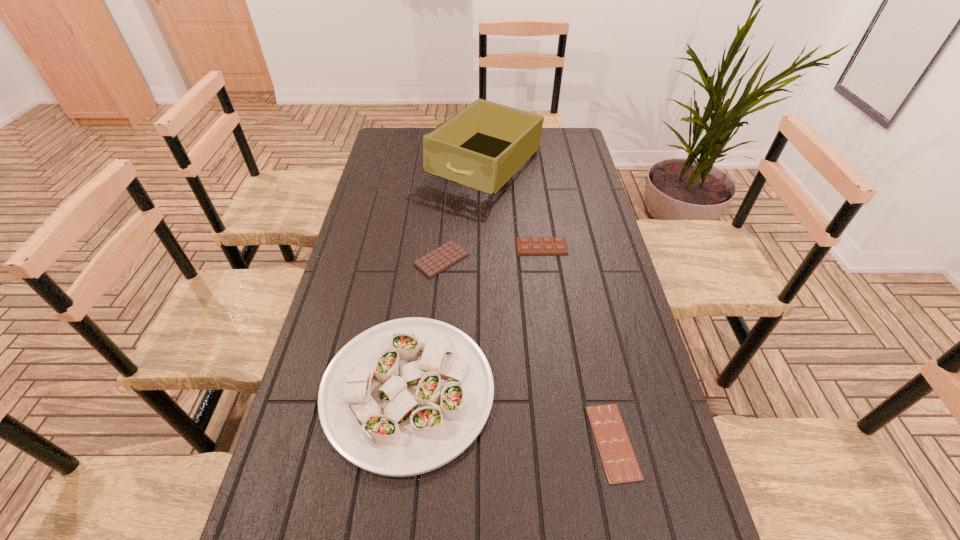
At what (x,y) coordinates should I click in order to perform the action: click on vacant space that satisfies the following two spatial constraints: 1. on the front side of the third tallest object; 2. on the right side of the shortest chocolate bar. Please return your answer as a coordinate pair (x, y). Looking at the image, I should click on (569, 442).

This screenshot has width=960, height=540. In order to click on free space that satisfies the following two spatial constraints: 1. on the front side of the tallest chocolate bar; 2. on the right side of the shortest object in this screenshot , I will do `click(569, 442)`.

I want to click on free space that satisfies the following two spatial constraints: 1. on the front side of the farthest object; 2. on the right side of the third shortest object, so click(487, 247).

Identify the location of free location that satisfies the following two spatial constraints: 1. on the front side of the tallest chocolate bar; 2. on the left side of the shortest object. The height and width of the screenshot is (540, 960). [x=569, y=442].